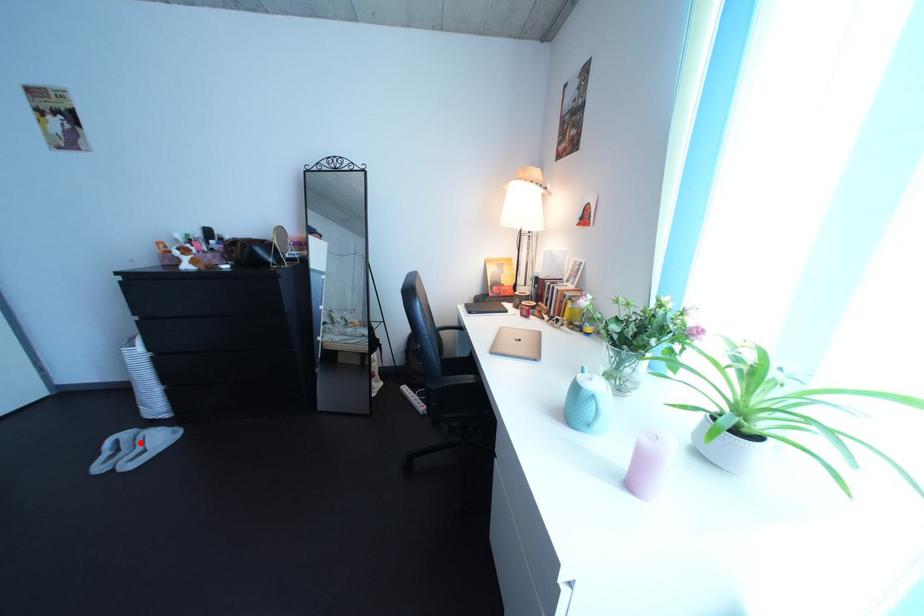
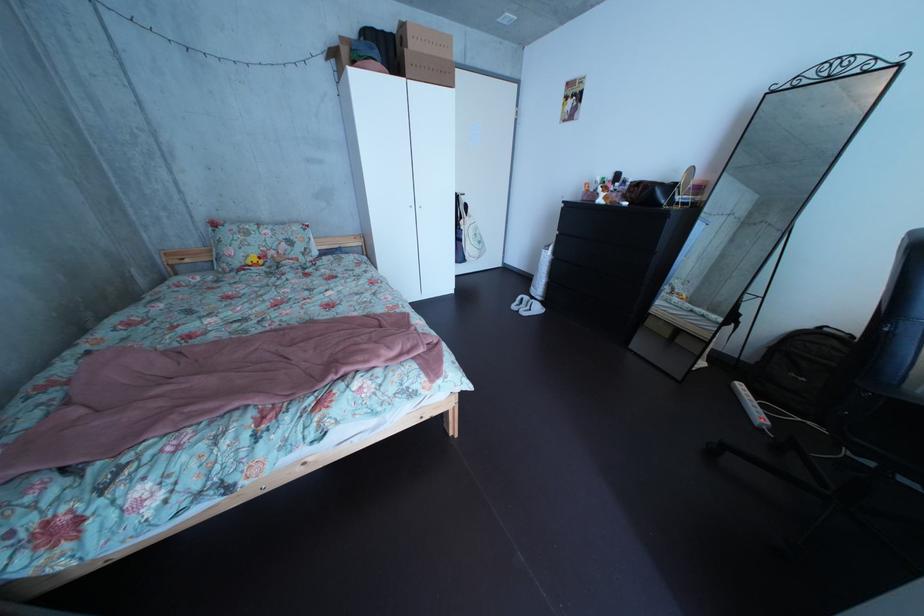
Question: A red point is marked in image1. In image2, is the corresponding 3D point closer to the camera or farther? Reply with the corresponding letter.

Choices:
 (A) The corresponding 3D point is closer.
 (B) The corresponding 3D point is farther.

Answer: (A)